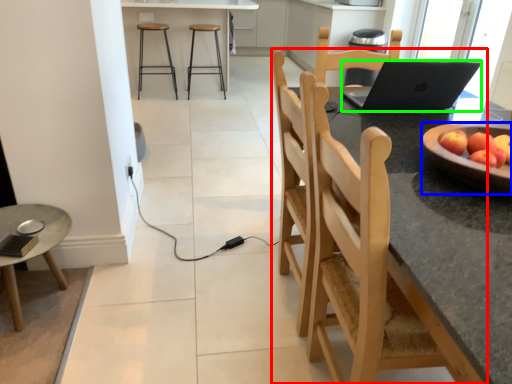
Question: Considering the real-world distances, which object is farthest from chair (highlighted by a red box)? bowl (highlighted by a blue box) or laptop (highlighted by a green box)?

Choices:
 (A) bowl
 (B) laptop

Answer: (B)